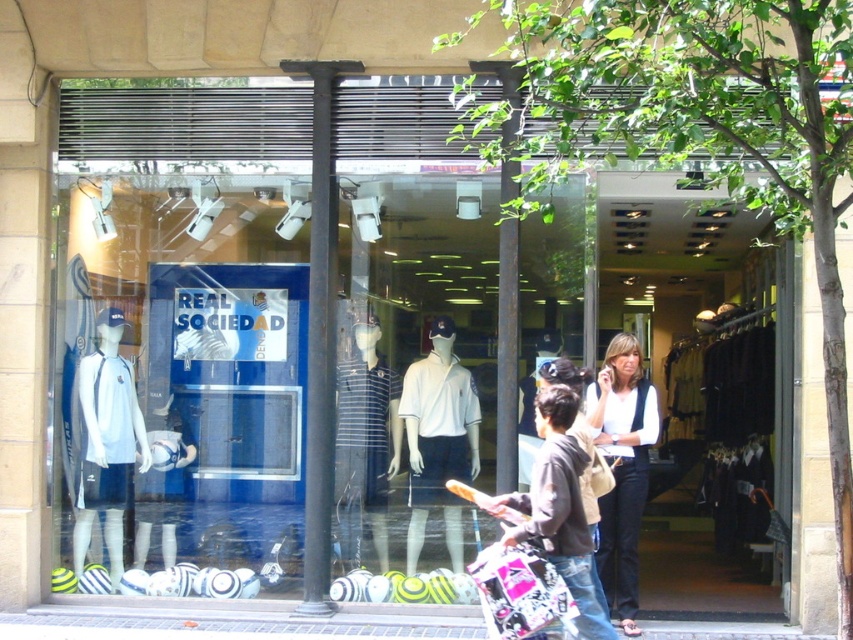
Question: Considering the relative positions of white matte polo shirt at center and dark brown hoodie at center in the image provided, where is white matte polo shirt at center located with respect to dark brown hoodie at center?

Choices:
 (A) above
 (B) below

Answer: (A)

Question: Which point is closer to the camera?

Choices:
 (A) dark brown hoodie at center
 (B) striped fabric polo shirt at center

Answer: (A)

Question: Is white jersey at center thinner than dark brown hoodie at center?

Choices:
 (A) no
 (B) yes

Answer: (B)

Question: Which point is farther to the camera?

Choices:
 (A) white jersey at center
 (B) white matte polo shirt at center
 (C) white matte jersey at left
 (D) dark brown hoodie at center

Answer: (C)

Question: Can you confirm if striped fabric polo shirt at center is positioned above dark brown hoodie at center?

Choices:
 (A) yes
 (B) no

Answer: (A)

Question: Considering the real-world distances, which object is closest to the white matte polo shirt at center?

Choices:
 (A) dark brown hoodie at center
 (B) striped fabric polo shirt at center
 (C) white jersey at center
 (D) white matte jersey at left

Answer: (B)